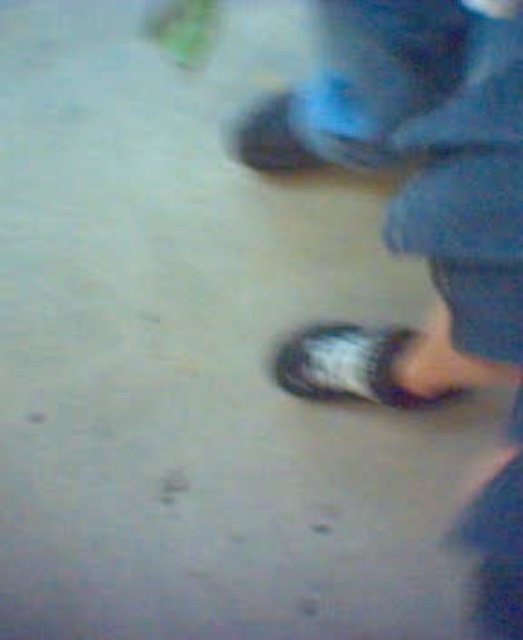
Question: Which object is closer to the camera taking this photo?

Choices:
 (A) matte blue shoe at upper center
 (B) white textured sandal at lower center

Answer: (B)

Question: Where is black rubber sandals at lower center located in relation to white textured sandal at lower center in the image?

Choices:
 (A) left
 (B) right

Answer: (A)

Question: Which object is the farthest from the white textured sandal at lower center?

Choices:
 (A) black rubber sandals at lower center
 (B) matte blue shoe at upper center

Answer: (B)

Question: Where is white textured sandal at lower center located in relation to matte blue shoe at upper center in the image?

Choices:
 (A) left
 (B) right

Answer: (B)

Question: Among these points, which one is nearest to the camera?

Choices:
 (A) (262, 147)
 (B) (518, 333)

Answer: (B)

Question: Does black rubber sandals at lower center have a lesser width compared to white textured sandal at lower center?

Choices:
 (A) yes
 (B) no

Answer: (B)